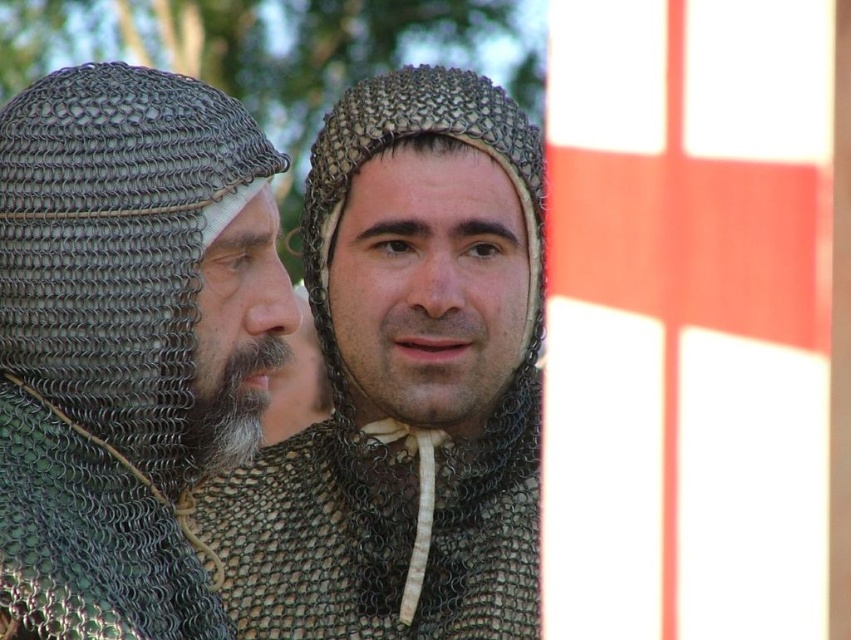
Is chainmail helmet at center in front of chainmail helmet at left?

No.

Is chainmail helmet at center below chainmail helmet at left?

No.

Where is `chainmail helmet at center`? The width and height of the screenshot is (851, 640). chainmail helmet at center is located at coordinates (404, 381).